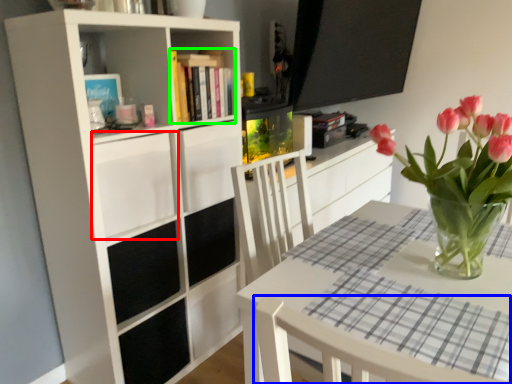
Question: Based on their relative distances, which object is farther from drawer (highlighted by a red box)? Choose from chair (highlighted by a blue box) and book (highlighted by a green box).

Choices:
 (A) chair
 (B) book

Answer: (A)